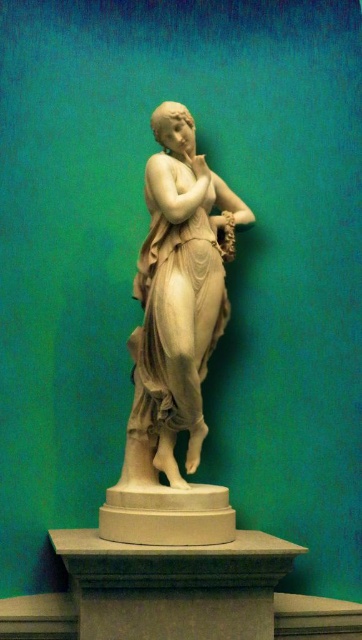
What do you see at coordinates (178, 296) in the screenshot?
I see `white marble statue at center` at bounding box center [178, 296].

Identify the location of white marble statue at center. The image size is (362, 640). (178, 296).

Find the location of `white marble statue at center`. white marble statue at center is located at coordinates (178, 296).